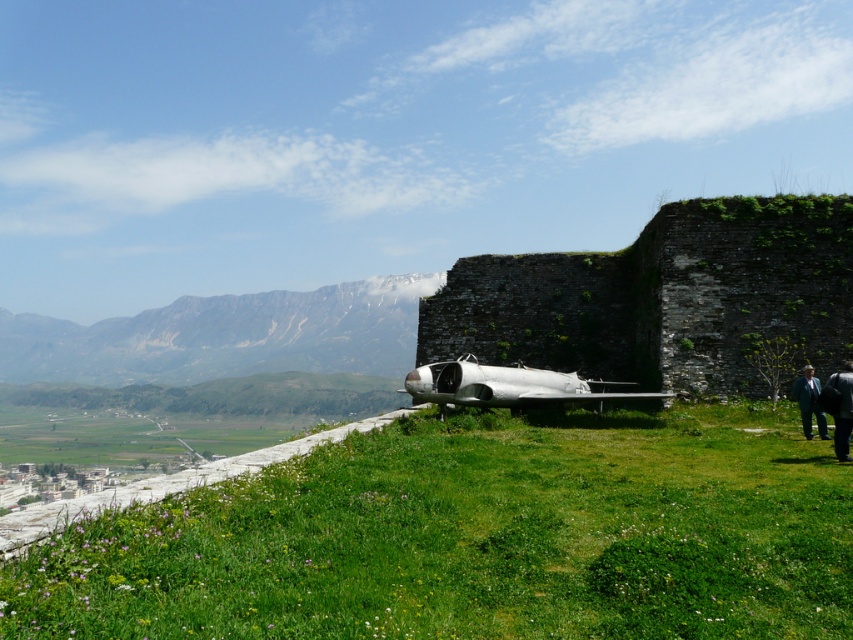
Question: Can you confirm if stone wall at center is thinner than dark blue suit at lower right?

Choices:
 (A) no
 (B) yes

Answer: (A)

Question: Which object is positioned farthest from the green grassy at lower center?

Choices:
 (A) dark gray suit at lower right
 (B) stone wall at center

Answer: (B)

Question: Which point is closer to the camera taking this photo?

Choices:
 (A) (817, 392)
 (B) (107, 621)
 (C) (689, 204)
 (D) (846, 456)

Answer: (B)

Question: Does dark gray suit at lower right have a greater width compared to dark blue suit at lower right?

Choices:
 (A) yes
 (B) no

Answer: (A)

Question: Which of the following is the closest to the observer?

Choices:
 (A) dark blue suit at lower right
 (B) stone wall at center

Answer: (A)

Question: Does dark gray suit at lower right come behind dark blue suit at lower right?

Choices:
 (A) yes
 (B) no

Answer: (B)